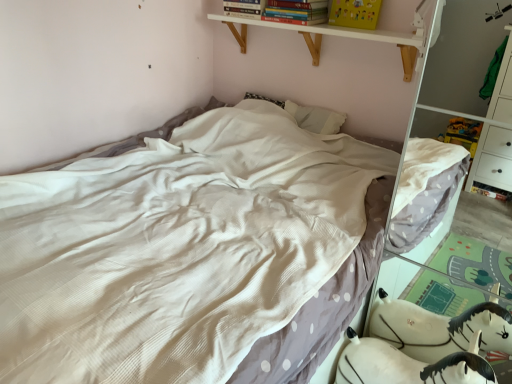
Question: From a real-world perspective, is white plush toy at lower right beneath white wood shelf at upper center?

Choices:
 (A) yes
 (B) no

Answer: (A)

Question: Would you say white plush toy at lower right is a long distance from white wood shelf at upper center?

Choices:
 (A) yes
 (B) no

Answer: (A)

Question: Does white plush toy at lower right touch white wood shelf at upper center?

Choices:
 (A) yes
 (B) no

Answer: (B)

Question: Would you say white wood shelf at upper center is part of white plush toy at lower right's contents?

Choices:
 (A) no
 (B) yes

Answer: (A)

Question: Is white plush toy at lower right closer to the viewer compared to white wood shelf at upper center?

Choices:
 (A) yes
 (B) no

Answer: (A)

Question: From a real-world perspective, is white textured bed at center positioned above or below white plush toy at lower right?

Choices:
 (A) below
 (B) above

Answer: (B)

Question: Is white textured bed at center inside or outside of white plush toy at lower right?

Choices:
 (A) outside
 (B) inside

Answer: (A)

Question: Is white textured bed at center bigger or smaller than white plush toy at lower right?

Choices:
 (A) big
 (B) small

Answer: (A)

Question: Considering the positions of point (51, 230) and point (448, 344), is point (51, 230) closer or farther from the camera than point (448, 344)?

Choices:
 (A) closer
 (B) farther

Answer: (A)

Question: In the image, is hardcover book at upper center, which appears as the first book when viewed from the left, on the left side or the right side of hardcover book at upper center, placed as the 2th book when sorted from left to right?

Choices:
 (A) right
 (B) left

Answer: (B)

Question: Is hardcover book at upper center, the second book viewed from the right, in front of or behind hardcover book at upper center, placed as the 2th book when sorted from left to right, in the image?

Choices:
 (A) front
 (B) behind

Answer: (B)

Question: Based on their sizes in the image, would you say hardcover book at upper center, the second book viewed from the right, is bigger or smaller than hardcover book at upper center, the 1th book viewed from the right?

Choices:
 (A) small
 (B) big

Answer: (B)

Question: Which is correct: hardcover book at upper center, which appears as the first book when viewed from the left, is inside hardcover book at upper center, placed as the 2th book when sorted from left to right, or outside of it?

Choices:
 (A) inside
 (B) outside

Answer: (B)

Question: Is white textured bed at center bigger or smaller than hardcover book at upper center, the second book viewed from the right?

Choices:
 (A) big
 (B) small

Answer: (A)

Question: Choose the correct answer: Is white textured bed at center inside hardcover book at upper center, which appears as the first book when viewed from the left, or outside it?

Choices:
 (A) inside
 (B) outside

Answer: (B)